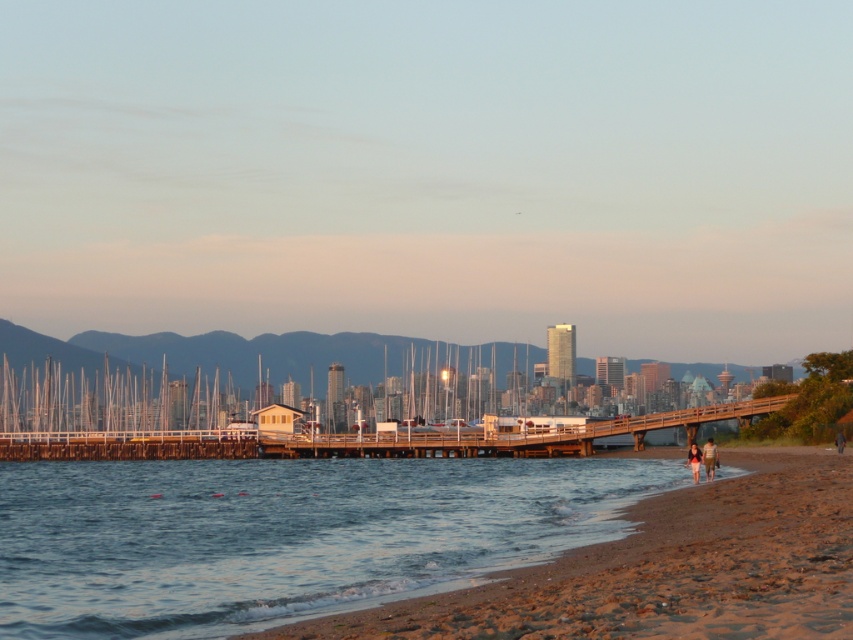
You are standing on the beach and want to walk to the brown wooden dock at center. Which direction should you head to avoid the clear water at lower left?

You should head to the right side of the brown wooden dock at center to avoid the clear water at lower left since the clear water at lower left is on the left side of the brown wooden dock at center.

You are standing on the beach and want to walk towards the brown wooden dock at center. From your current position, which direction should you walk to avoid stepping into the clear water at lower left?

You should walk to the right of the brown wooden dock at center to avoid the clear water at lower left, as the clear water at lower left is above the dock, meaning it is located in front of it.

You are standing on the beach looking towards the pier. You see the clear water at lower left and the dark blue jeans at lower right. Which object is nearer to you?

The clear water at lower left is closer to the viewer than the dark blue jeans at lower right.